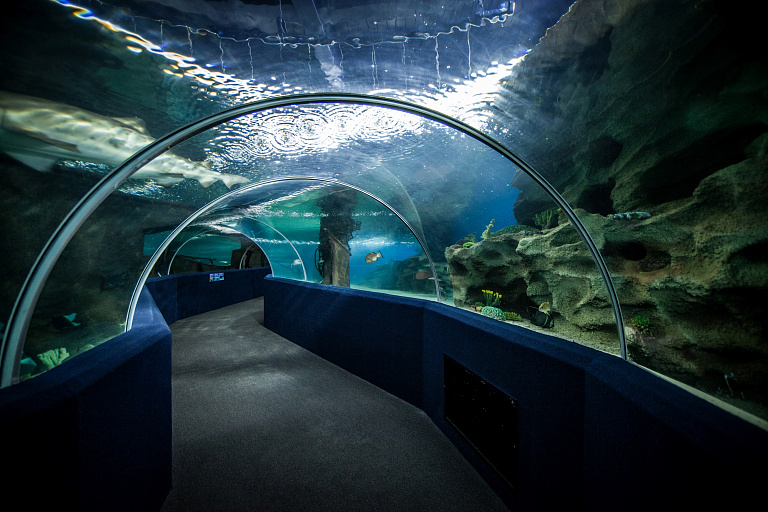
This screenshot has height=512, width=768. I want to click on glass, so click(x=455, y=220), click(x=353, y=176), click(x=210, y=218), click(x=179, y=239), click(x=141, y=258), click(x=259, y=250), click(x=212, y=237), click(x=295, y=236).